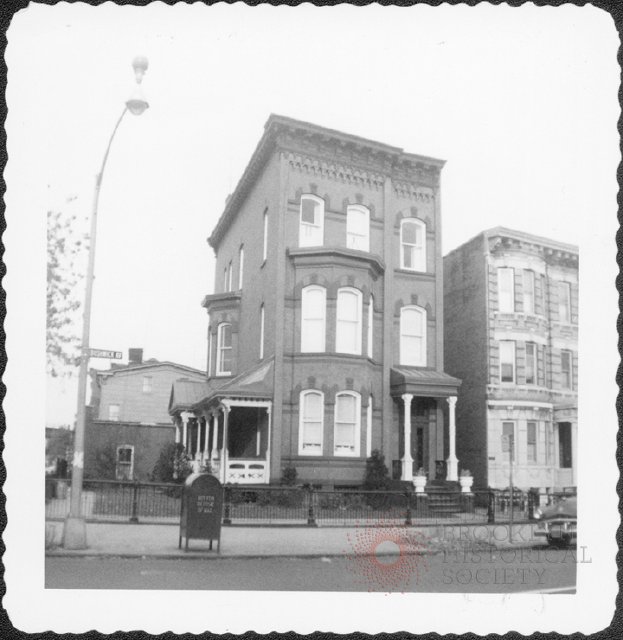
Identify the location of column. The height and width of the screenshot is (640, 623). (453, 422), (407, 429), (227, 422), (217, 429), (206, 436), (199, 442), (186, 436), (177, 436).